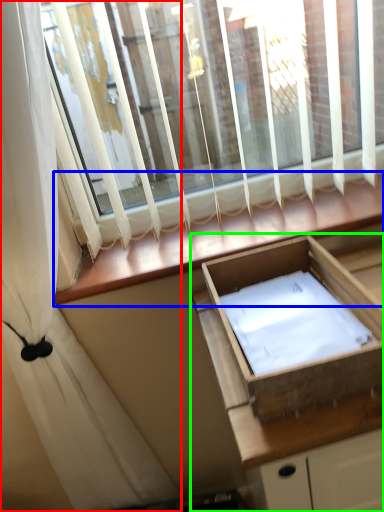
Question: Which object is the farthest from curtain (highlighted by a red box)? Choose among these: window sill (highlighted by a blue box) or cabinetry (highlighted by a green box).

Choices:
 (A) window sill
 (B) cabinetry

Answer: (B)